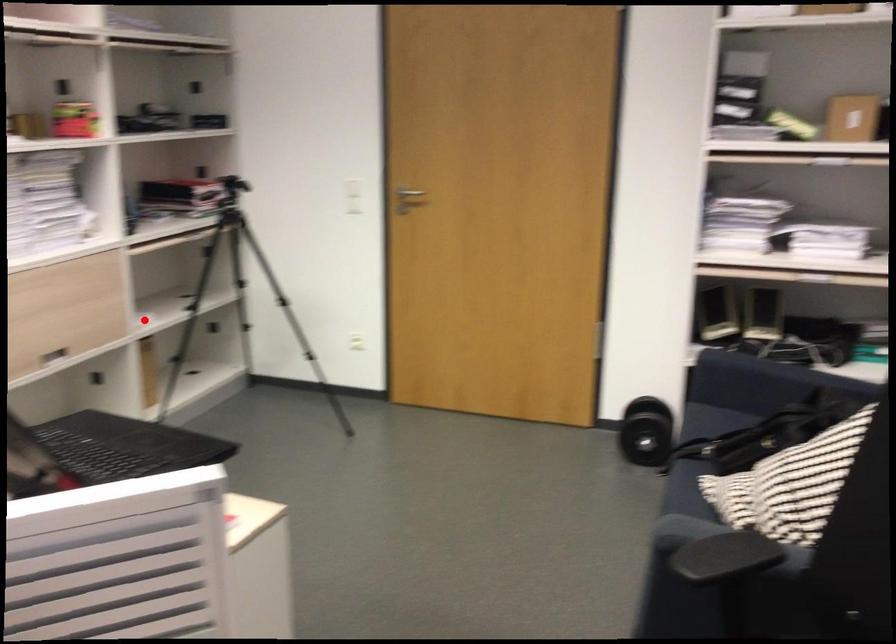
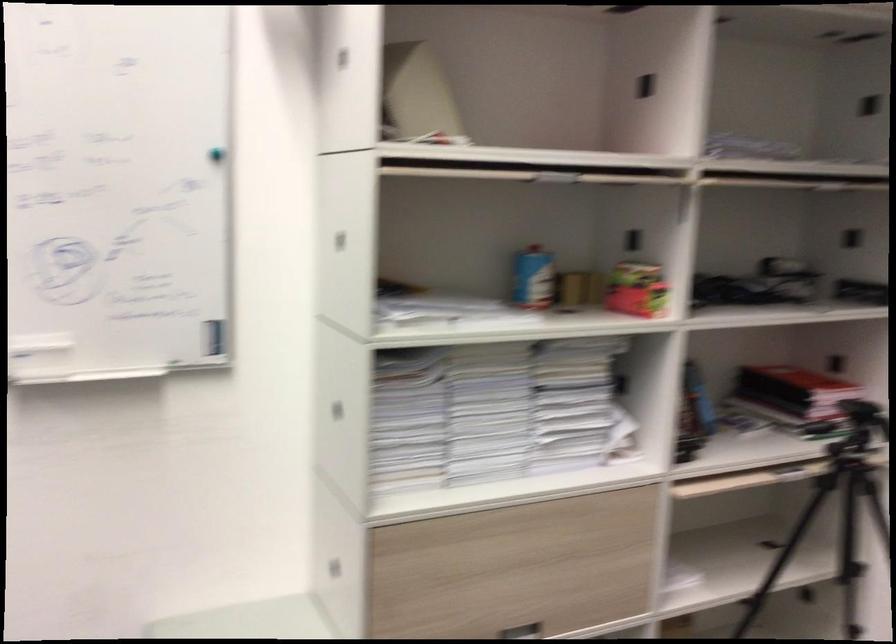
Where in the second image is the point corresponding to the highlighted location from the first image?

(678, 581)